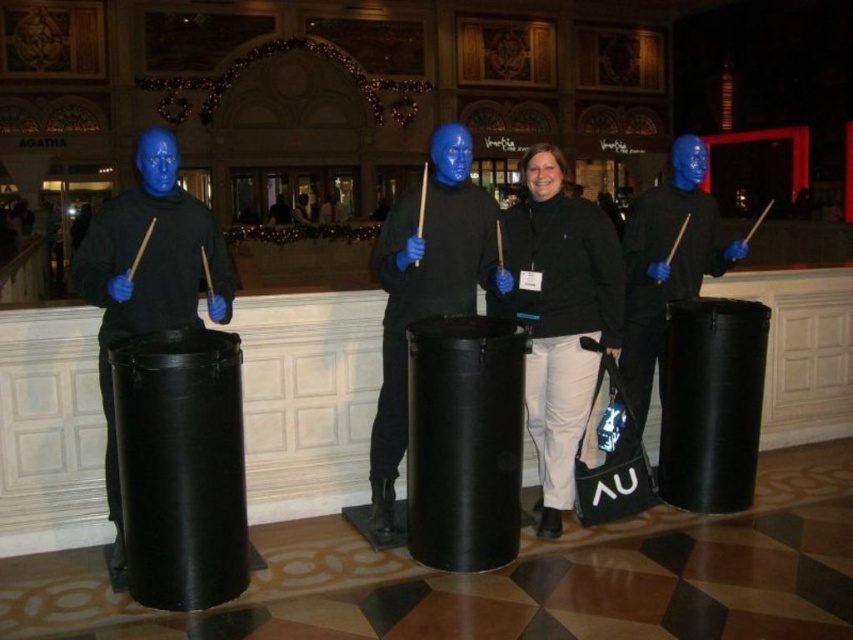
Question: Is black matte jacket at center smaller than matte black drum at right?

Choices:
 (A) yes
 (B) no

Answer: (A)

Question: Which point appears farthest from the camera in this image?

Choices:
 (A) (138, 269)
 (B) (641, 340)
 (C) (447, 268)

Answer: (B)

Question: Which object is the closest to the black matte jacket at center?

Choices:
 (A) matte black drum at center
 (B) matte black drum at right
 (C) matte black drum at left

Answer: (B)

Question: Is matte black drum at left positioned in front of matte black drum at center?

Choices:
 (A) no
 (B) yes

Answer: (B)

Question: Is black matte jacket at center below matte black drum at right?

Choices:
 (A) no
 (B) yes

Answer: (B)

Question: Which object is closer to the camera taking this photo?

Choices:
 (A) matte black drum at center
 (B) matte black drum at left
 (C) black matte jacket at center

Answer: (B)